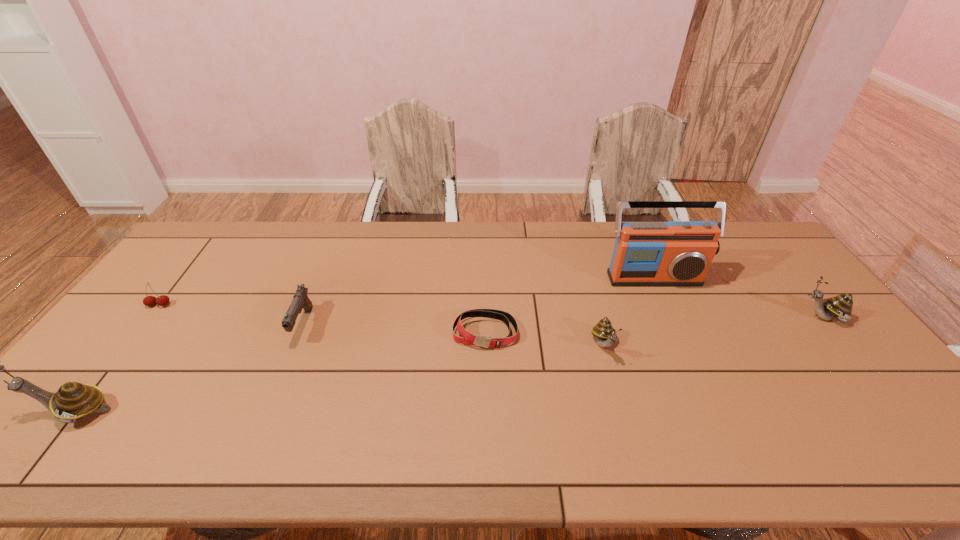
Where is `dog collar`? dog collar is located at coordinates (467, 338).

Locate an element on the screen. The width and height of the screenshot is (960, 540). cherry is located at coordinates (163, 300).

The image size is (960, 540). In order to click on vacant area situated on the face of the second farthest snail in this screenshot , I will do pos(620,402).

The width and height of the screenshot is (960, 540). Find the location of `vacant space situated 0.260m on the face of the fifth shortest object`. vacant space situated 0.260m on the face of the fifth shortest object is located at coordinates (708, 318).

Image resolution: width=960 pixels, height=540 pixels. I want to click on free region located 0.200m on the face of the fifth shortest object, so click(729, 318).

Image resolution: width=960 pixels, height=540 pixels. Identify the location of free space located on the face of the fifth shortest object. (664, 318).

Find the location of a particular element. Image resolution: width=960 pixels, height=540 pixels. free location located 0.230m on the front-facing side of the tallest object is located at coordinates (684, 345).

Where is `free space located in the direction the gun is aimed`? The image size is (960, 540). free space located in the direction the gun is aimed is located at coordinates coord(278,383).

At what (x,y) coordinates should I click in order to perform the action: click on free region located on the left of the fourth object from right to left. Please return your answer as a coordinate pair (x, y). Image resolution: width=960 pixels, height=540 pixels. Looking at the image, I should click on (414, 333).

Find the location of a particular element. vacant point located 0.330m on the surface of the cherry is located at coordinates (82, 405).